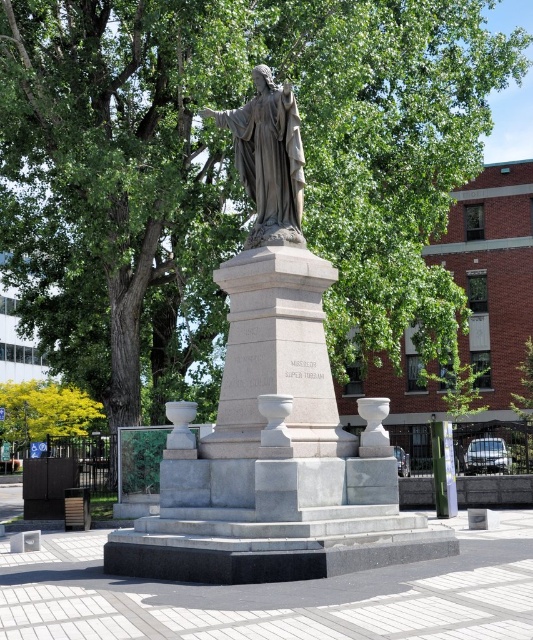
You are standing in the public square and want to take a photo of the matte gray statue at center. If you are positioned at point A, which is directly north of the statue, where should you move to ensure the statue is centered in your camera frame?

Since the matte gray statue at center is located at point coordinates, you should move to a position directly south of the statue to center it in your camera frame.